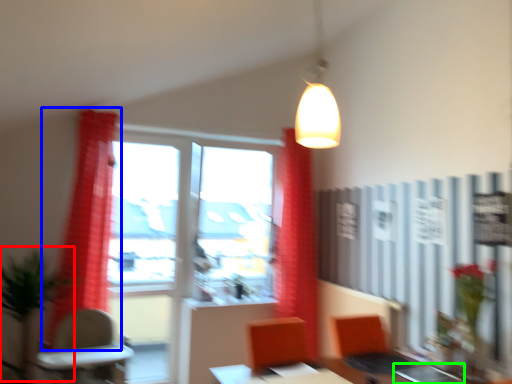
Question: Which is nearer to the plant (highlighted by a red box)? curtain (highlighted by a blue box) or table (highlighted by a green box).

Choices:
 (A) curtain
 (B) table

Answer: (A)